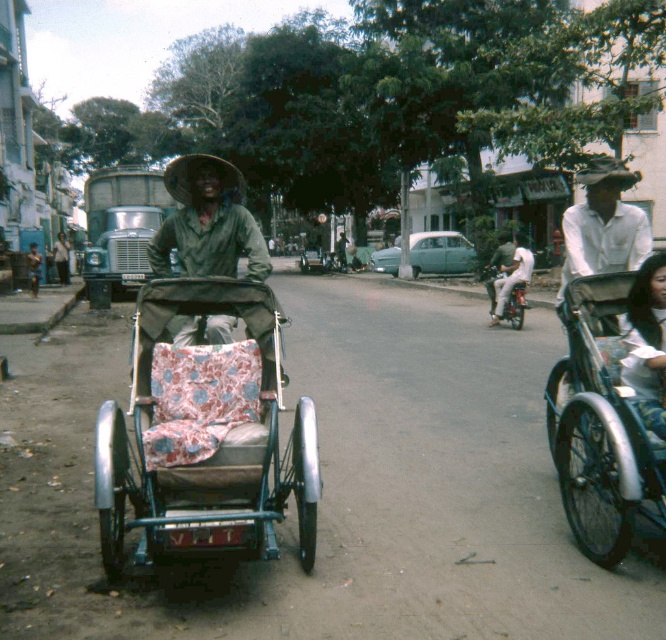
Between patterned fabric baby carriage at left and metallic silver motorcycle at center-right, which one is positioned higher?

Positioned higher is metallic silver motorcycle at center-right.

Can you confirm if patterned fabric baby carriage at left is positioned to the right of metallic silver motorcycle at center-right?

No, patterned fabric baby carriage at left is not to the right of metallic silver motorcycle at center-right.

This screenshot has height=640, width=666. I want to click on patterned fabric baby carriage at left, so click(204, 436).

The width and height of the screenshot is (666, 640). I want to click on patterned fabric baby carriage at left, so click(204, 436).

Does patterned fabric baby carriage at left appear over metallic silver tricycle at right?

No.

Does patterned fabric baby carriage at left have a smaller size compared to metallic silver tricycle at right?

No.

Measure the distance between patterned fabric baby carriage at left and camera.

The distance of patterned fabric baby carriage at left from camera is 3.59 meters.

This screenshot has height=640, width=666. I want to click on patterned fabric baby carriage at left, so click(204, 436).

Which is below, green fabric hat at center or patterned fabric tricycle at center?

patterned fabric tricycle at center

Which is more to the right, green fabric hat at center or patterned fabric tricycle at center?

Positioned to the right is green fabric hat at center.

Which is in front, point (224, 328) or point (99, 177)?

Point (224, 328)

Image resolution: width=666 pixels, height=640 pixels. What are the coordinates of `green fabric hat at center` in the screenshot? It's located at (206, 221).